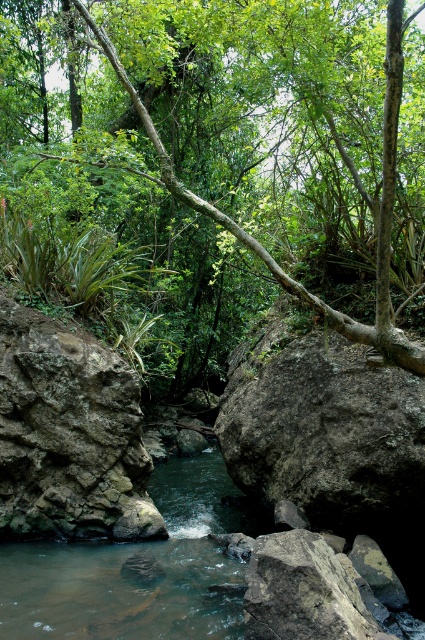
Is rough textured rock at center in front of brown/rocky river at center?

No, rough textured rock at center is behind brown/rocky river at center.

How distant is rough textured rock at center from brown/rocky river at center?

rough textured rock at center is 1.09 meters away from brown/rocky river at center.

What do you see at coordinates (68, 435) in the screenshot?
I see `rough textured rock at center` at bounding box center [68, 435].

Where is `rough textured rock at center`? The image size is (425, 640). rough textured rock at center is located at coordinates (68, 435).

Is green leafy tree at center above rough textured rock at center?

Yes.

You are a GUI agent. You are given a task and a screenshot of the screen. Output one action in this format:
    pyautogui.click(x=<x>, y=<y>)
    Task: Click on the green leafy tree at center
    
    Given the screenshot: What is the action you would take?
    pyautogui.click(x=221, y=156)

Identify the location of green leafy tree at center. (221, 156).

Image resolution: width=425 pixels, height=640 pixels. Identify the location of green leafy tree at center. (221, 156).

Image resolution: width=425 pixels, height=640 pixels. Describe the element at coordinates (221, 156) in the screenshot. I see `green leafy tree at center` at that location.

Is the position of green leafy tree at center less distant than that of brown/rocky river at center?

Yes, it is in front of brown/rocky river at center.

This screenshot has height=640, width=425. Describe the element at coordinates (221, 156) in the screenshot. I see `green leafy tree at center` at that location.

You are a GUI agent. You are given a task and a screenshot of the screen. Output one action in this format:
    pyautogui.click(x=<x>, y=<y>)
    Task: Click on the green leafy tree at center
    This screenshot has width=425, height=640.
    Given the screenshot: What is the action you would take?
    pyautogui.click(x=221, y=156)